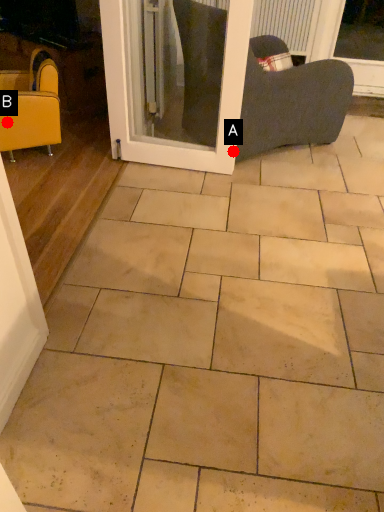
Question: Two points are circled on the image, labeled by A and B beside each circle. Which point is farther from the camera taking this photo?

Choices:
 (A) A is further
 (B) B is further

Answer: (A)